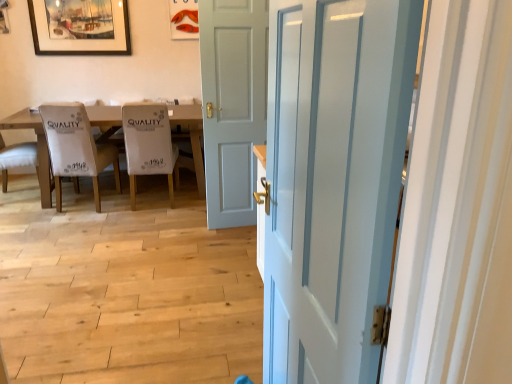
Question: Is white fabric chair at center, marked as the first chair in a right-to-left arrangement, far away from white glossy door at center, the 1th door in the front-to-back sequence?

Choices:
 (A) no
 (B) yes

Answer: (B)

Question: Is white fabric chair at center, marked as the first chair in a right-to-left arrangement, behind white glossy door at center, which appears as the first door when viewed from the right?

Choices:
 (A) yes
 (B) no

Answer: (A)

Question: Is white fabric chair at center, marked as the first chair in a right-to-left arrangement, at the left side of white glossy door at center, arranged as the 2th door when viewed from the left?

Choices:
 (A) no
 (B) yes

Answer: (B)

Question: Considering the relative sizes of white fabric chair at center, placed as the 3th chair when sorted from left to right, and white glossy door at center, which appears as the first door when viewed from the right, in the image provided, is white fabric chair at center, placed as the 3th chair when sorted from left to right, shorter than white glossy door at center, which appears as the first door when viewed from the right,?

Choices:
 (A) yes
 (B) no

Answer: (A)

Question: From a real-world perspective, is white fabric chair at center, marked as the first chair in a right-to-left arrangement, physically below white glossy door at center, the 1th door in the front-to-back sequence?

Choices:
 (A) no
 (B) yes

Answer: (B)

Question: From a real-world perspective, is white fabric chair at left, which is the 2th chair from left to right, positioned above or below light gray wood door at center, which is the 2th door from right to left?

Choices:
 (A) below
 (B) above

Answer: (A)

Question: Visually, is white fabric chair at left, the 2th chair viewed from the right, positioned to the left or to the right of light gray wood door at center, marked as the 1th door in a left-to-right arrangement?

Choices:
 (A) left
 (B) right

Answer: (A)

Question: Is white fabric chair at left, which is the 2th chair from left to right, bigger or smaller than light gray wood door at center, which is counted as the second door, starting from the front?

Choices:
 (A) big
 (B) small

Answer: (A)

Question: From the image's perspective, is white fabric chair at left, which is the 2th chair from left to right, located above or below light gray wood door at center, which is counted as the second door, starting from the front?

Choices:
 (A) below
 (B) above

Answer: (A)

Question: Is point (190, 130) positioned closer to the camera than point (15, 160)?

Choices:
 (A) closer
 (B) farther

Answer: (B)

Question: In terms of size, does wooden table at left appear bigger or smaller than white fabric chair at left, which is the first chair in left-to-right order?

Choices:
 (A) small
 (B) big

Answer: (B)

Question: Which is correct: wooden table at left is inside white fabric chair at left, the 3th chair from the right, or outside of it?

Choices:
 (A) outside
 (B) inside

Answer: (A)

Question: In terms of width, does wooden table at left look wider or thinner when compared to white fabric chair at left, which is the first chair in left-to-right order?

Choices:
 (A) wide
 (B) thin

Answer: (A)

Question: From a real-world perspective, is wooden framed painting at upper left above or below wooden table at left?

Choices:
 (A) below
 (B) above

Answer: (B)

Question: Is wooden framed painting at upper left inside the boundaries of wooden table at left, or outside?

Choices:
 (A) outside
 (B) inside

Answer: (A)